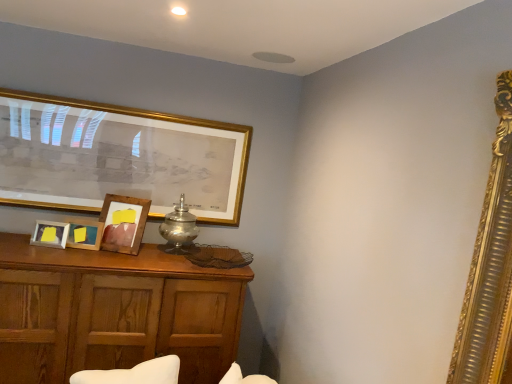
Where is `vacant point to the right of wooden picture frame at center, the third picture frame in the front-to-back sequence`? The width and height of the screenshot is (512, 384). vacant point to the right of wooden picture frame at center, the third picture frame in the front-to-back sequence is located at coordinates (148, 249).